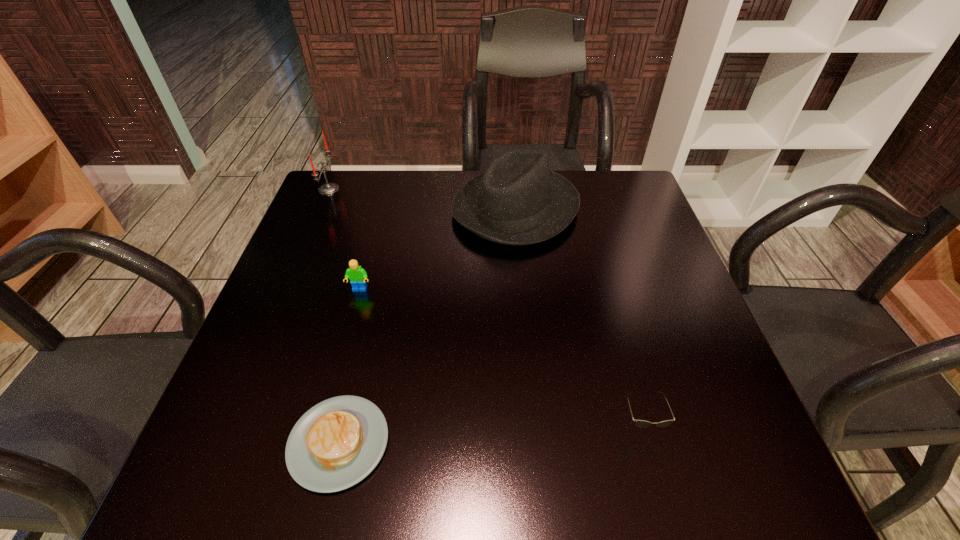
Image resolution: width=960 pixels, height=540 pixels. Find the location of `free point between the Lego and the fourth tallest object`. free point between the Lego and the fourth tallest object is located at coordinates (500, 356).

Identify the location of vacant space in between the fourth tallest object and the fedora. (578, 315).

Where is `vacant point located between the third nearest object and the pancake`? The width and height of the screenshot is (960, 540). vacant point located between the third nearest object and the pancake is located at coordinates [x=349, y=366].

At what (x,y) coordinates should I click in order to perform the action: click on free space between the fedora and the pancake. Please return your answer as a coordinate pair (x, y). The height and width of the screenshot is (540, 960). Looking at the image, I should click on (427, 326).

You are a GUI agent. You are given a task and a screenshot of the screen. Output one action in this format:
    pyautogui.click(x=<x>, y=<y>)
    Task: Click on the free point between the Lego and the pancake
    The image size is (960, 540).
    Given the screenshot: What is the action you would take?
    pyautogui.click(x=349, y=366)

At what (x,y) coordinates should I click in order to perform the action: click on vacant area between the shortest object and the fedora. Please return your answer as a coordinate pair (x, y). The image size is (960, 540). Looking at the image, I should click on (427, 326).

Find the location of a particular element. The width and height of the screenshot is (960, 540). the third closest object relative to the Lego is located at coordinates (328, 188).

Identify the location of the third closest object relative to the leftmost object. The height and width of the screenshot is (540, 960). (337, 443).

The image size is (960, 540). I want to click on free location that satisfies the following two spatial constraints: 1. on the face of the Lego; 2. on the right side of the pancake, so click(x=320, y=442).

Identify the location of vacant space that satisfies the following two spatial constraints: 1. on the back side of the fedora; 2. on the front-facing side of the leftmost object. (514, 189).